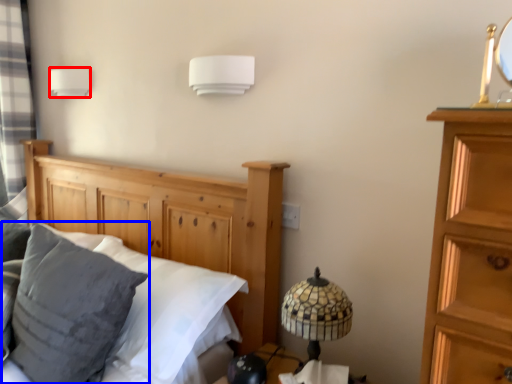
Question: Among these objects, which one is farthest to the camera, lamp (highlighted by a red box) or pillow (highlighted by a blue box)?

Choices:
 (A) lamp
 (B) pillow

Answer: (A)